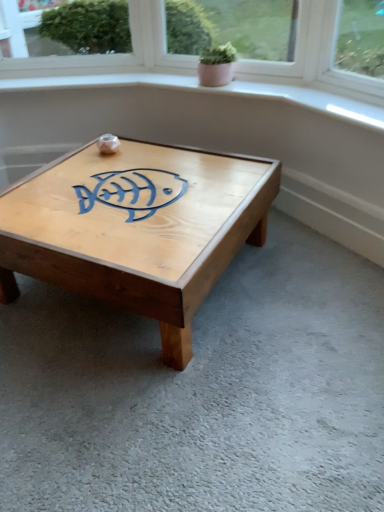
Question: Should I look upward or downward to see natural wood coffee table at center?

Choices:
 (A) up
 (B) down

Answer: (A)

Question: From a real-world perspective, is natural wood coffee table at center physically above pink matte pot at upper center?

Choices:
 (A) yes
 (B) no

Answer: (B)

Question: Is natural wood coffee table at center oriented away from pink matte pot at upper center?

Choices:
 (A) yes
 (B) no

Answer: (B)

Question: Is natural wood coffee table at center shorter than pink matte pot at upper center?

Choices:
 (A) yes
 (B) no

Answer: (B)

Question: Does natural wood coffee table at center have a lesser width compared to pink matte pot at upper center?

Choices:
 (A) no
 (B) yes

Answer: (A)

Question: From a real-world perspective, is natural wood coffee table at center positioned under pink matte pot at upper center based on gravity?

Choices:
 (A) no
 (B) yes

Answer: (B)

Question: Considering the relative sizes of natural wood coffee table at center and pink matte pot at upper center in the image provided, is natural wood coffee table at center smaller than pink matte pot at upper center?

Choices:
 (A) yes
 (B) no

Answer: (B)

Question: Does pink matte pot at upper center have a greater height compared to natural wood coffee table at center?

Choices:
 (A) no
 (B) yes

Answer: (A)

Question: Does pink matte pot at upper center have a smaller size compared to natural wood coffee table at center?

Choices:
 (A) yes
 (B) no

Answer: (A)

Question: Is pink matte pot at upper center to the left of natural wood coffee table at center from the viewer's perspective?

Choices:
 (A) no
 (B) yes

Answer: (A)

Question: Does pink matte pot at upper center have a larger size compared to natural wood coffee table at center?

Choices:
 (A) no
 (B) yes

Answer: (A)

Question: Could you tell me if pink matte pot at upper center is facing natural wood coffee table at center?

Choices:
 (A) yes
 (B) no

Answer: (B)

Question: From the image's perspective, would you say pink matte pot at upper center is positioned over natural wood coffee table at center?

Choices:
 (A) no
 (B) yes

Answer: (B)

Question: Is point (221, 180) positioned closer to the camera than point (233, 55)?

Choices:
 (A) farther
 (B) closer

Answer: (B)